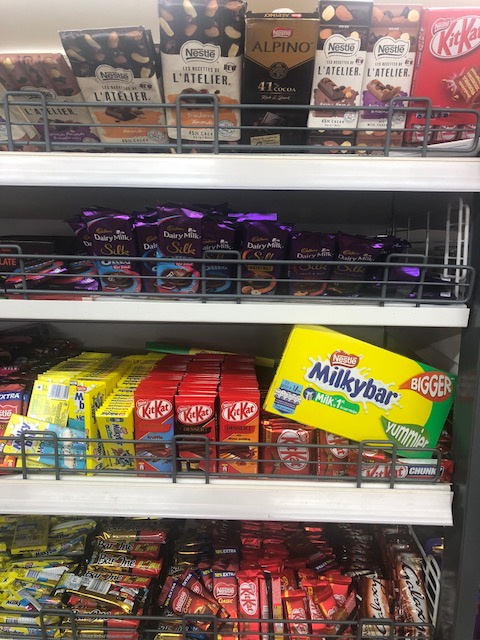
The image size is (480, 640). I want to click on back shelf wall, so click(x=106, y=335), click(x=40, y=201).